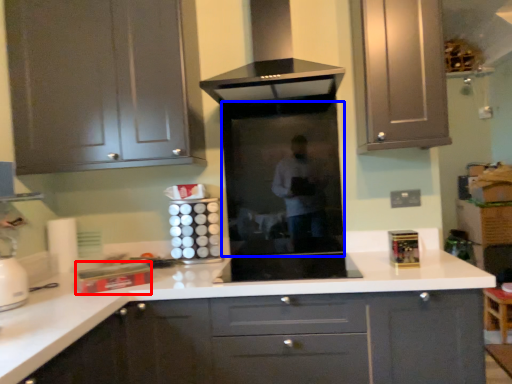
Question: Which object is closer to the camera taking this photo, appliance (highlighted by a red box) or glass door (highlighted by a blue box)?

Choices:
 (A) appliance
 (B) glass door

Answer: (A)